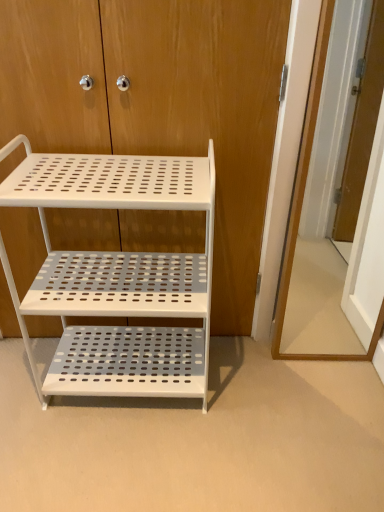
Where is `free spot in front of wooden door at right`? This screenshot has height=512, width=384. free spot in front of wooden door at right is located at coordinates (327, 397).